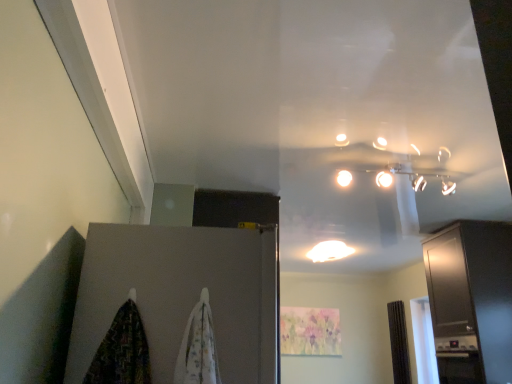
Question: From the image's perspective, is brown textured curtain at right, the first curtain in the right-to-left sequence, beneath white glossy light fixture at center?

Choices:
 (A) yes
 (B) no

Answer: (A)

Question: Is brown textured curtain at right, acting as the first curtain starting from the bottom, looking in the opposite direction of white glossy light fixture at center?

Choices:
 (A) no
 (B) yes

Answer: (A)

Question: Does brown textured curtain at right, acting as the first curtain starting from the bottom, have a lesser width compared to white glossy light fixture at center?

Choices:
 (A) yes
 (B) no

Answer: (A)

Question: Is brown textured curtain at right, the 2th curtain positioned from the top, bigger than white glossy light fixture at center?

Choices:
 (A) yes
 (B) no

Answer: (A)

Question: Does brown textured curtain at right, marked as the second curtain in a left-to-right arrangement, come behind white glossy light fixture at center?

Choices:
 (A) yes
 (B) no

Answer: (A)

Question: Considering the relative sizes of brown textured curtain at right, which ranks as the second curtain in front-to-back order, and white glossy light fixture at center in the image provided, is brown textured curtain at right, which ranks as the second curtain in front-to-back order, taller than white glossy light fixture at center?

Choices:
 (A) yes
 (B) no

Answer: (A)

Question: Could brown textured curtain at right, marked as the second curtain in a left-to-right arrangement, be considered to be inside matte gray door at lower left?

Choices:
 (A) yes
 (B) no

Answer: (B)

Question: From a real-world perspective, does matte gray door at lower left sit lower than brown textured curtain at right, the first curtain in the right-to-left sequence?

Choices:
 (A) yes
 (B) no

Answer: (A)

Question: Is matte gray door at lower left thinner than brown textured curtain at right, the 2th curtain positioned from the top?

Choices:
 (A) no
 (B) yes

Answer: (A)

Question: Is matte gray door at lower left closer to camera compared to brown textured curtain at right, the 2th curtain positioned from the top?

Choices:
 (A) yes
 (B) no

Answer: (A)

Question: Is matte gray door at lower left next to brown textured curtain at right, which ranks as the second curtain in front-to-back order?

Choices:
 (A) no
 (B) yes

Answer: (A)

Question: Is matte gray door at lower left bigger than brown textured curtain at right, the 2th curtain positioned from the top?

Choices:
 (A) no
 (B) yes

Answer: (B)

Question: Can you see white glossy light fixture at center touching satin black cabinet at right?

Choices:
 (A) no
 (B) yes

Answer: (A)